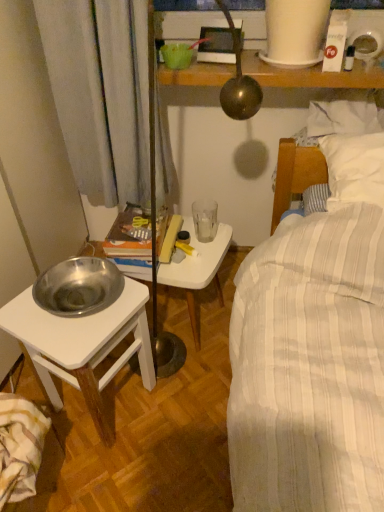
Locate an element on the screen. free space to the right of silver metallic bowl at left is located at coordinates (187, 411).